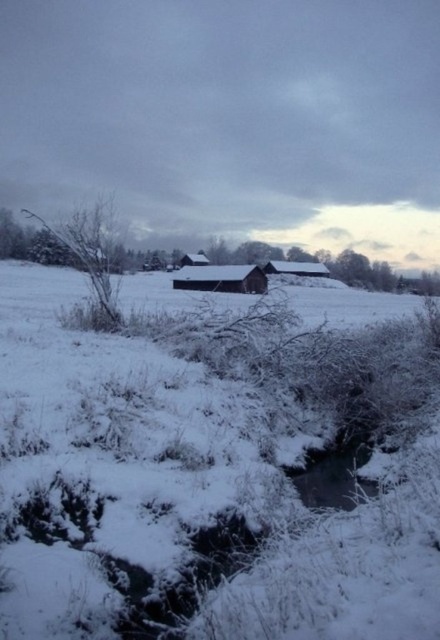
Question: Which of the following is the farthest from the observer?

Choices:
 (A) brown wooden hut at center
 (B) white wooden hut at center

Answer: (A)

Question: Is wooden barn at center behind brown wooden hut at center?

Choices:
 (A) no
 (B) yes

Answer: (A)

Question: Which point is farther from the camera taking this photo?

Choices:
 (A) (200, 276)
 (B) (201, 252)
 (C) (194, 602)
 (D) (300, 269)

Answer: (B)

Question: Which point is closer to the camera?

Choices:
 (A) (322, 276)
 (B) (193, 257)
 (C) (143, 589)
 (D) (211, 266)

Answer: (C)

Question: Is white fluffy snow at center below brown wooden hut at center?

Choices:
 (A) no
 (B) yes

Answer: (B)

Question: Is white fluffy snow at center bigger than wooden barn at center?

Choices:
 (A) yes
 (B) no

Answer: (A)